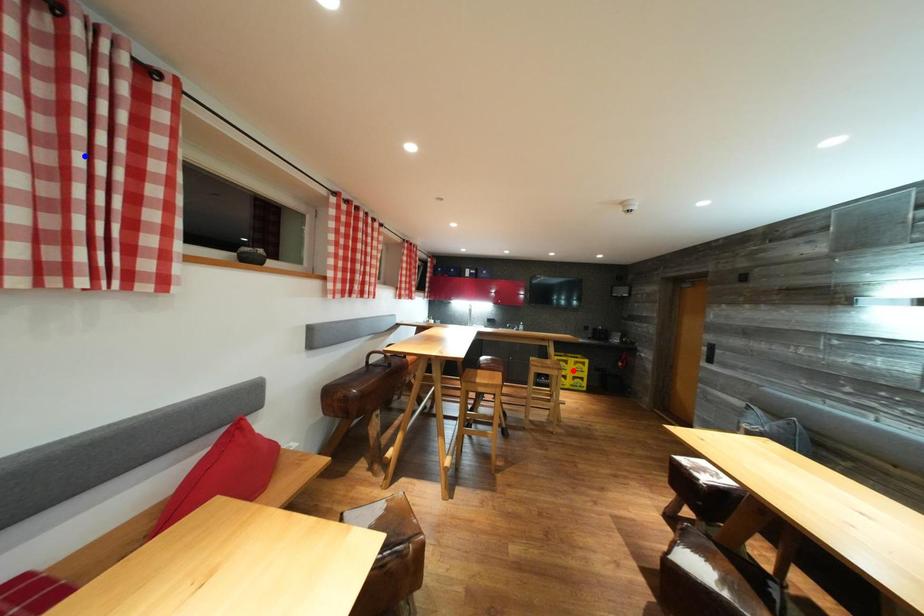
Question: Two points are marked on the image. Which point is closer to the camera?

Choices:
 (A) Blue point is closer.
 (B) Red point is closer.

Answer: (A)